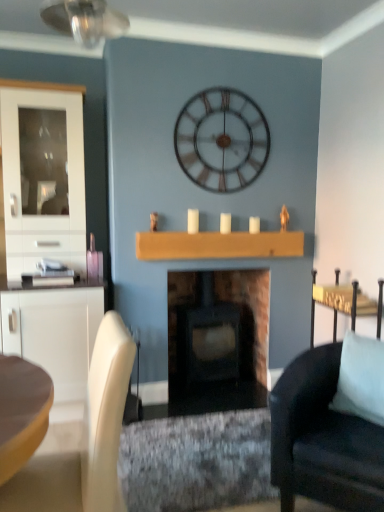
The image size is (384, 512). Describe the element at coordinates (43, 178) in the screenshot. I see `white glossy cabinet at left` at that location.

Consider the image. Measure the distance between white matte candle at center, the first candle when ordered from left to right, and camera.

white matte candle at center, the first candle when ordered from left to right, is 2.84 meters from camera.

Describe the element at coordinates (196, 461) in the screenshot. I see `gray wool rug at lower center` at that location.

The image size is (384, 512). What do you see at coordinates (218, 245) in the screenshot?
I see `wooden mantel at center` at bounding box center [218, 245].

Where is `white leather swivel chair at lower left`? white leather swivel chair at lower left is located at coordinates (84, 439).

Measure the distance from white matte candle at center, which appears as the first candle when viewed from the right, to wooden mantel at center.

white matte candle at center, which appears as the first candle when viewed from the right, is 12.89 inches away from wooden mantel at center.

Considering the sizes of objects white matte candle at center, which appears as the 3th candle when viewed from the left, and wooden mantel at center in the image provided, who is bigger, white matte candle at center, which appears as the 3th candle when viewed from the left, or wooden mantel at center?

With larger size is wooden mantel at center.

Where is `mantle that is below the white matte candle at center, which appears as the first candle when viewed from the right (from the image's perspective)`? The width and height of the screenshot is (384, 512). mantle that is below the white matte candle at center, which appears as the first candle when viewed from the right (from the image's perspective) is located at coordinates (218, 245).

Is white matte candle at center, which appears as the 3th candle when viewed from the left, at the left side of wooden mantel at center?

In fact, white matte candle at center, which appears as the 3th candle when viewed from the left, is to the right of wooden mantel at center.

From a real-world perspective, which is physically above, gray wool rug at lower center or black fabric chair at right?

black fabric chair at right, from a real-world perspective.

Between point (187, 465) and point (348, 439), which one is positioned behind?

The point (187, 465) is more distant.

In terms of width, does gray wool rug at lower center look wider or thinner when compared to black fabric chair at right?

Considering their sizes, gray wool rug at lower center looks broader than black fabric chair at right.

In order to click on molding below the black fabric chair at right (from a real-world perspective) in this screenshot , I will do `click(196, 461)`.

Considering the positions of objects white leather swivel chair at lower left and gray wool rug at lower center in the image provided, who is more to the left, white leather swivel chair at lower left or gray wool rug at lower center?

white leather swivel chair at lower left is more to the left.

Does point (88, 426) appear closer or farther from the camera than point (240, 422)?

Point (88, 426) is positioned closer to the camera compared to point (240, 422).

From a real-world perspective, which object rests below the other?

gray wool rug at lower center is physically lower.

Measure the distance from white leather swivel chair at lower left to gray wool rug at lower center.

A distance of 88.32 centimeters exists between white leather swivel chair at lower left and gray wool rug at lower center.

Can you confirm if matte black wood-burning stove at center is positioned to the right of white leather swivel chair at lower left?

Yes.

Is matte black wood-burning stove at center positioned with its back to white leather swivel chair at lower left?

matte black wood-burning stove at center is not turned away from white leather swivel chair at lower left.

Based on their sizes in the image, would you say matte black wood-burning stove at center is bigger or smaller than white leather swivel chair at lower left?

Considering their sizes, matte black wood-burning stove at center takes up more space than white leather swivel chair at lower left.

Is matte black wood-burning stove at center further to camera compared to white leather swivel chair at lower left?

Yes, it is behind white leather swivel chair at lower left.

Based on the photo, can you confirm if metallic gold side table at right is positioned to the right of wooden mantel at center?

Correct, you'll find metallic gold side table at right to the right of wooden mantel at center.

From the picture: Is metallic gold side table at right inside the boundaries of wooden mantel at center, or outside?

metallic gold side table at right is not inside wooden mantel at center, it's outside.

Relative to wooden mantel at center, is metallic gold side table at right in front or behind?

Visually, metallic gold side table at right is located in front of wooden mantel at center.

Can you confirm if metallic gold side table at right is smaller than wooden mantel at center?

No.

Is white matte candle at center, the first candle when ordered from left to right, inside white leather swivel chair at lower left?

No, white leather swivel chair at lower left does not contain white matte candle at center, the first candle when ordered from left to right.

From a real-world perspective, is white leather swivel chair at lower left beneath white matte candle at center, the first candle when ordered from left to right?

Correct, in the physical world, white leather swivel chair at lower left is lower than white matte candle at center, the first candle when ordered from left to right.

Considering the relative sizes of white leather swivel chair at lower left and white matte candle at center, the first candle when ordered from left to right, in the image provided, is white leather swivel chair at lower left shorter than white matte candle at center, the first candle when ordered from left to right,?

No.

Is white leather swivel chair at lower left facing towards white matte candle at center, the first candle when ordered from left to right?

No, white leather swivel chair at lower left is not oriented towards white matte candle at center, the first candle when ordered from left to right.

Are black fabric chair at right and metallic silver clock at upper center far apart?

black fabric chair at right is positioned a significant distance from metallic silver clock at upper center.

Can you tell me how much black fabric chair at right and metallic silver clock at upper center differ in facing direction?

45.8 degrees separate the facing orientations of black fabric chair at right and metallic silver clock at upper center.

Is point (313, 383) less distant than point (216, 163)?

Yes, it is.

Would you say metallic silver clock at upper center is part of black fabric chair at right's contents?

No, metallic silver clock at upper center is located outside of black fabric chair at right.

Find the location of a particular element. mantle in front of the white matte candle at center, which appears as the first candle when viewed from the right is located at coordinates [218, 245].

At what (x,y) coordinates should I click in order to perform the action: click on chair to the right of gray wool rug at lower center. Please return your answer as a coordinate pair (x, y). Looking at the image, I should click on point(323,439).

Which object lies nearer to the anchor point metallic gold side table at right, white glossy cabinet at left or gray wool rug at lower center?

gray wool rug at lower center is closer to metallic gold side table at right.

Considering their positions, is white matte candle at center, positioned as the 2th candle in right-to-left order, positioned closer to metallic silver clock at upper center than white matte candle at center, which appears as the 3th candle when viewed from the left?

white matte candle at center, positioned as the 2th candle in right-to-left order, lies closer to metallic silver clock at upper center than the other object.

When comparing their distances from light blue fabric pillow at right, does gray wool rug at lower center or matte black wood-burning stove at center seem closer?

Based on the image, gray wool rug at lower center appears to be nearer to light blue fabric pillow at right.

Which object lies nearer to the anchor point white leather swivel chair at lower left, gray wool rug at lower center or light blue fabric pillow at right?

gray wool rug at lower center is closer to white leather swivel chair at lower left.

From the image, which object appears to be nearer to light blue fabric pillow at right, metallic gold side table at right or black fabric chair at right?

The object closer to light blue fabric pillow at right is black fabric chair at right.

Estimate the real-world distances between objects in this image. Which object is further from white glossy cabinet at left, white matte candle at center, the first candle when ordered from left to right, or white leather swivel chair at lower left?

The object further to white glossy cabinet at left is white leather swivel chair at lower left.

From the picture: Based on their spatial positions, is white matte candle at center, positioned as the 2th candle in right-to-left order, or gray wool rug at lower center closer to wooden mantel at center?

Based on the image, white matte candle at center, positioned as the 2th candle in right-to-left order, appears to be nearer to wooden mantel at center.

Looking at the image, which one is located closer to white leather swivel chair at lower left, metallic silver clock at upper center or light blue fabric pillow at right?

The object closer to white leather swivel chair at lower left is light blue fabric pillow at right.

You are a GUI agent. You are given a task and a screenshot of the screen. Output one action in this format:
    pyautogui.click(x=<x>, y=<y>)
    Task: Click on the pillow between white leather swivel chair at lower left and metallic gold side table at right from left to right
    This screenshot has width=384, height=512.
    Given the screenshot: What is the action you would take?
    pyautogui.click(x=361, y=378)

At what (x,y) coordinates should I click in order to perform the action: click on chair between white leather swivel chair at lower left and white matte candle at center, which appears as the 3th candle when viewed from the left, along the z-axis. Please return your answer as a coordinate pair (x, y). The width and height of the screenshot is (384, 512). Looking at the image, I should click on (323, 439).

Image resolution: width=384 pixels, height=512 pixels. What are the coordinates of `side table that lies between white matte candle at center, the first candle when ordered from left to right, and gray wool rug at lower center from top to bottom` in the screenshot? It's located at (345, 303).

Identify the location of mantle that lies between metallic silver clock at upper center and metallic gold side table at right from top to bottom. The image size is (384, 512). (218, 245).